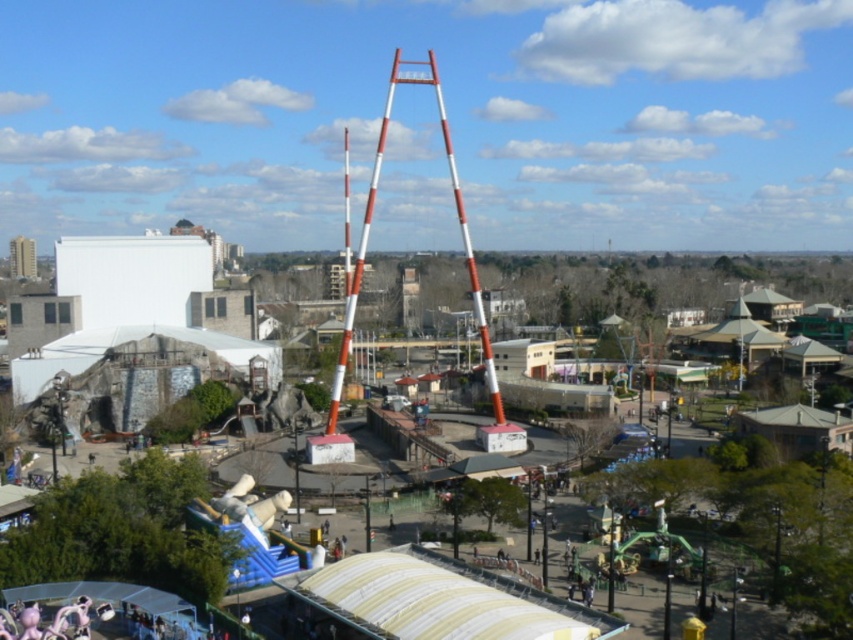
Can you confirm if smooth concrete amusement park at center is shorter than orange and white striped mast at center?

Indeed, smooth concrete amusement park at center has a lesser height compared to orange and white striped mast at center.

Between smooth concrete amusement park at center and orange and white striped mast at center, which one is positioned lower?

smooth concrete amusement park at center is below.

Who is more forward, (827, 598) or (392, 81)?

Positioned in front is point (827, 598).

Find the location of a particular element. smooth concrete amusement park at center is located at coordinates (126, 275).